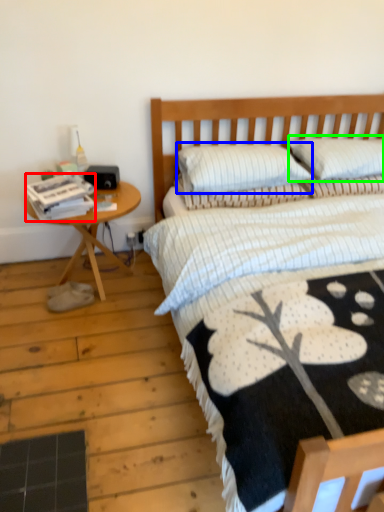
Question: Based on their relative distances, which object is farther from magazine (highlighted by a red box)? Choose from pillow (highlighted by a blue box) and pillow (highlighted by a green box).

Choices:
 (A) pillow
 (B) pillow

Answer: (B)